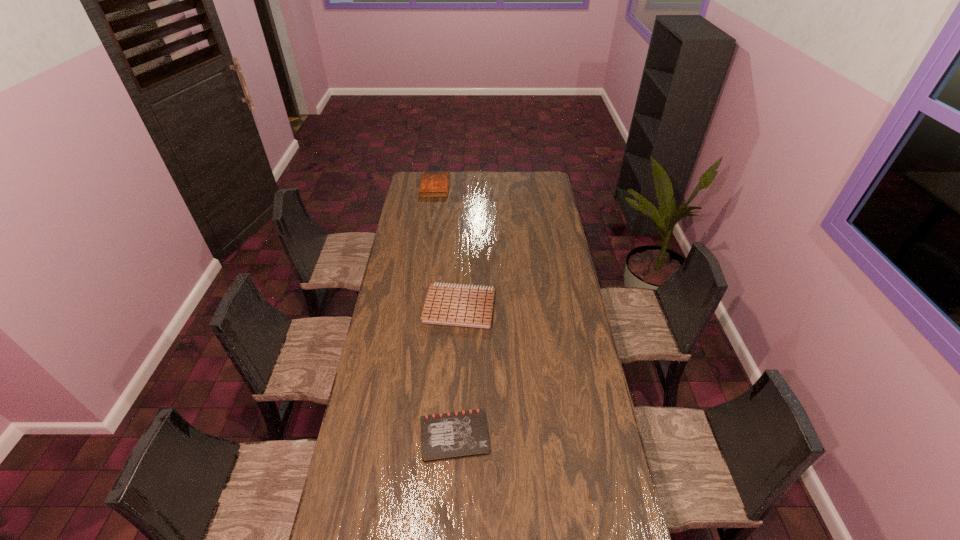
Where is `the farthest object`? The image size is (960, 540). the farthest object is located at coordinates (433, 184).

Identify the location of Bible. Image resolution: width=960 pixels, height=540 pixels. (433, 184).

Image resolution: width=960 pixels, height=540 pixels. In order to click on the taller notebook in this screenshot , I will do `click(465, 306)`.

The height and width of the screenshot is (540, 960). What are the coordinates of `the second farthest object` in the screenshot? It's located at (465, 306).

Where is `the nearest object`? This screenshot has height=540, width=960. the nearest object is located at coordinates (449, 435).

At what (x,y) coordinates should I click in order to perform the action: click on the shortest object. Please return your answer as a coordinate pair (x, y). Looking at the image, I should click on (449, 435).

Locate an element on the screen. free space located on the spine side of the Bible is located at coordinates (479, 187).

You are a GUI agent. You are given a task and a screenshot of the screen. Output one action in this format:
    pyautogui.click(x=<x>, y=<y>)
    Task: Click on the vacant space located 0.170m on the front of the taller notebook
    The height and width of the screenshot is (540, 960).
    Given the screenshot: What is the action you would take?
    pyautogui.click(x=457, y=361)

Locate an element on the screen. free location located 0.180m on the back of the shorter notebook is located at coordinates (457, 371).

Identify the location of object that is at the far edge. (433, 184).